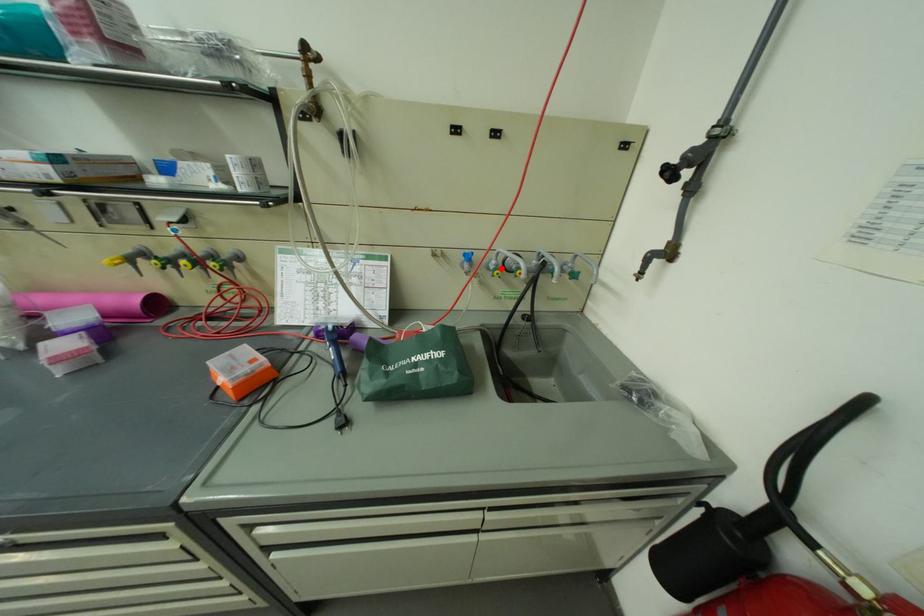
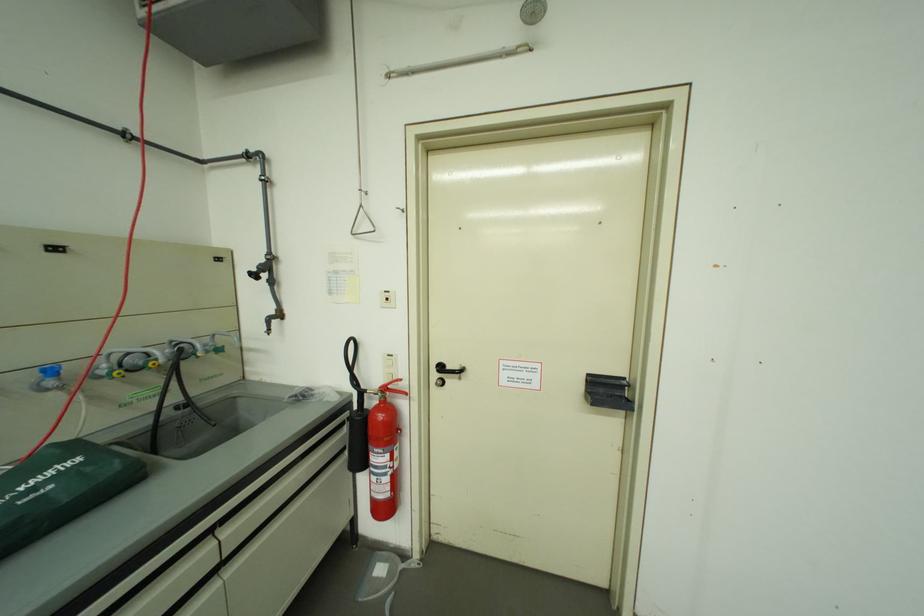
The point at the highlighted location is marked in the first image. Where is the corresponding point in the second image?

(113, 374)